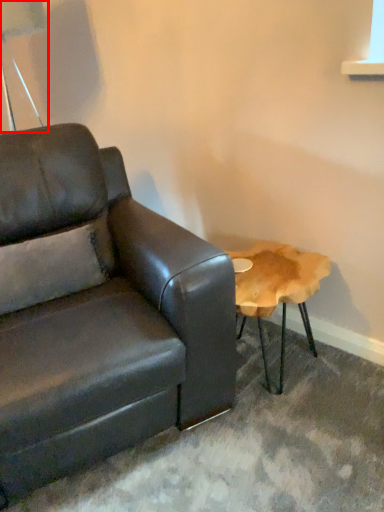
Question: From the image's perspective, where is table lamp (annotated by the red box) located in relation to studio couch in the image?

Choices:
 (A) above
 (B) below

Answer: (A)